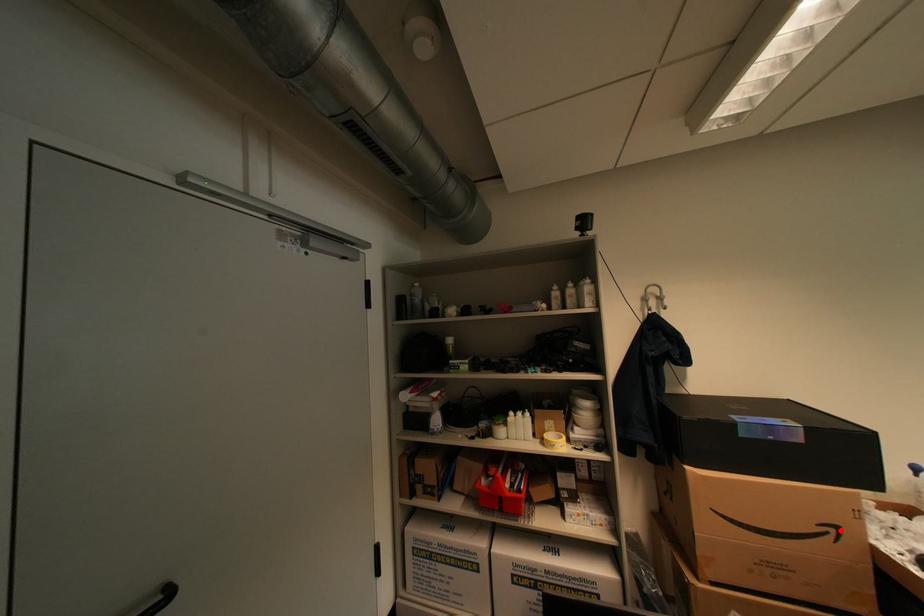
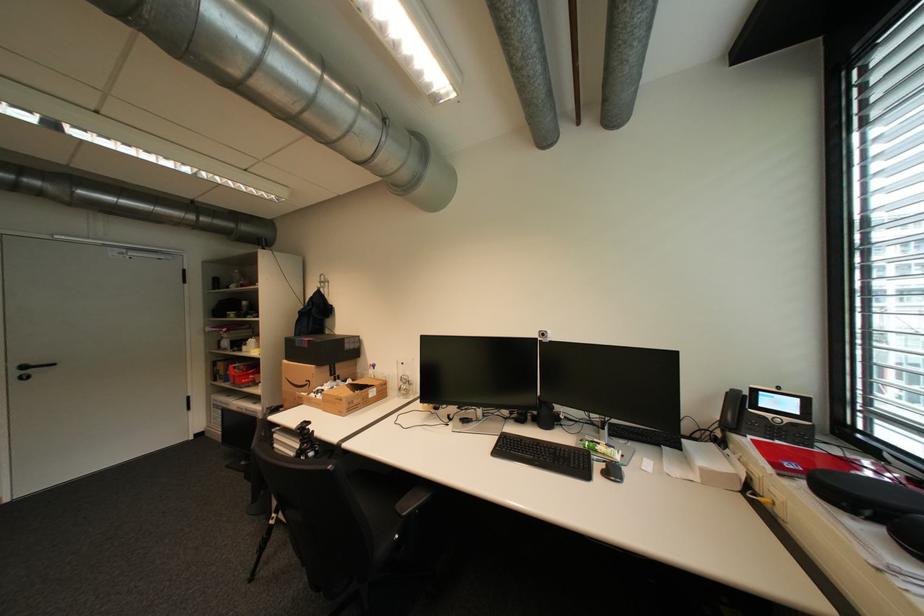
In the second image, find the point that corresponds to the highlighted location in the first image.

(317, 383)